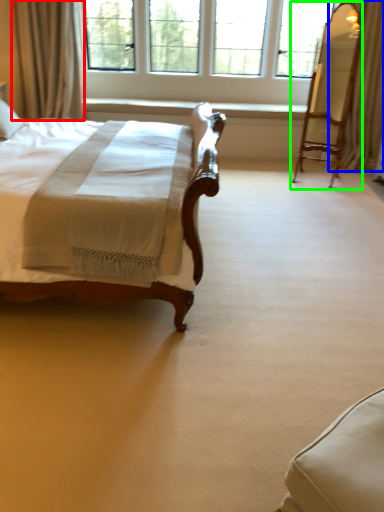
Question: Which is nearer to the curtain (highlighted by a red box)? curtain (highlighted by a blue box) or swivel chair (highlighted by a green box).

Choices:
 (A) curtain
 (B) swivel chair

Answer: (B)